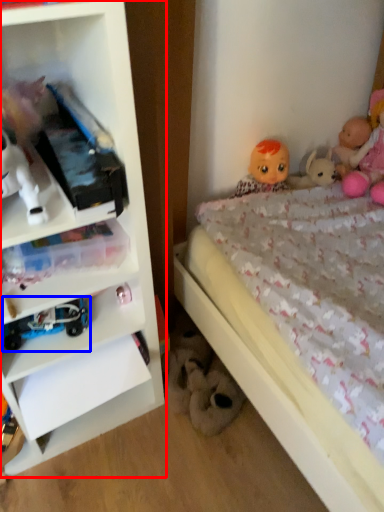
Question: Which of the following is the closest to the observer, shelf (highlighted by a red box) or toy (highlighted by a blue box)?

Choices:
 (A) shelf
 (B) toy

Answer: (A)